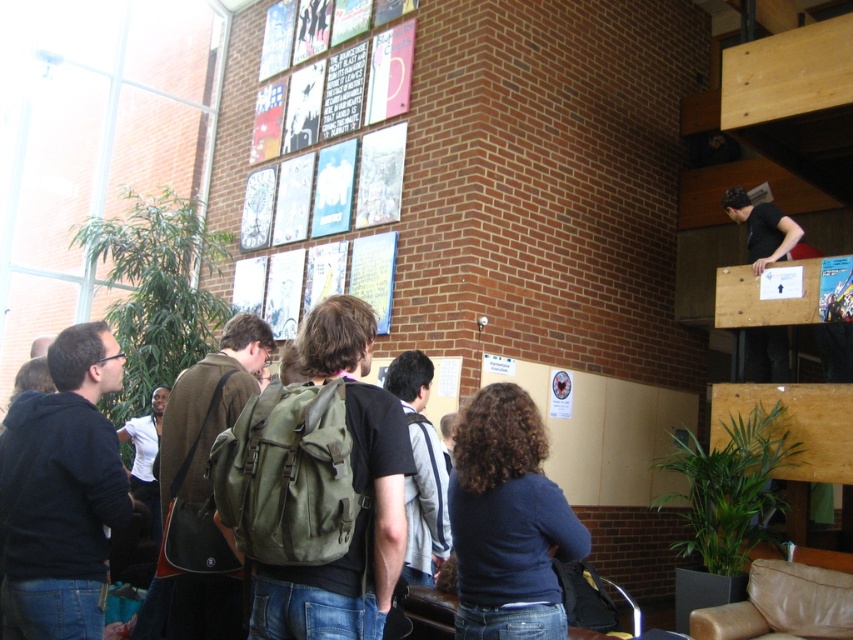
Based on the photo, is dark blue hoodie at center thinner than blue glossy poster at upper center?

In fact, dark blue hoodie at center might be wider than blue glossy poster at upper center.

Does dark blue hoodie at center have a lesser height compared to blue glossy poster at upper center?

Incorrect, dark blue hoodie at center's height does not fall short of blue glossy poster at upper center's.

Locate an element on the screen. This screenshot has width=853, height=640. dark blue hoodie at center is located at coordinates (62, 493).

Can you confirm if olive green backpack at center is positioned above white paper at upper center?

No.

Is olive green backpack at center positioned in front of white paper at upper center?

Yes, it is.

Who is more distant from viewer, (373, 545) or (786, 273)?

Point (786, 273)

Locate an element on the screen. The width and height of the screenshot is (853, 640). olive green backpack at center is located at coordinates (318, 486).

Can you confirm if matte paper posters at upper center is shorter than blue glossy poster at upper center?

In fact, matte paper posters at upper center may be taller than blue glossy poster at upper center.

Does matte paper posters at upper center have a greater width compared to blue glossy poster at upper center?

Indeed, matte paper posters at upper center has a greater width compared to blue glossy poster at upper center.

Between point (334, 86) and point (831, 288), which one is positioned in front?

Point (831, 288)

Identify the location of matte paper posters at upper center. The height and width of the screenshot is (640, 853). (334, 177).